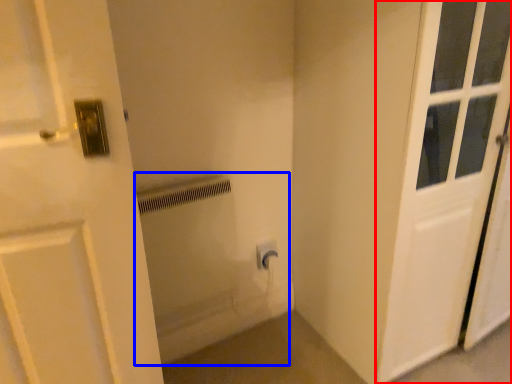
Question: Which object is further to the camera taking this photo, door (highlighted by a red box) or bath (highlighted by a blue box)?

Choices:
 (A) door
 (B) bath

Answer: (B)